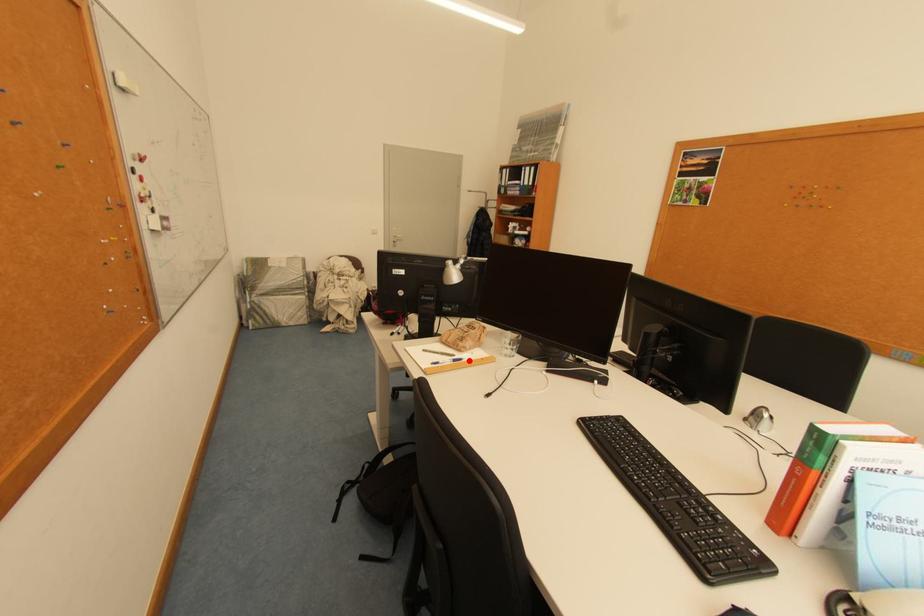
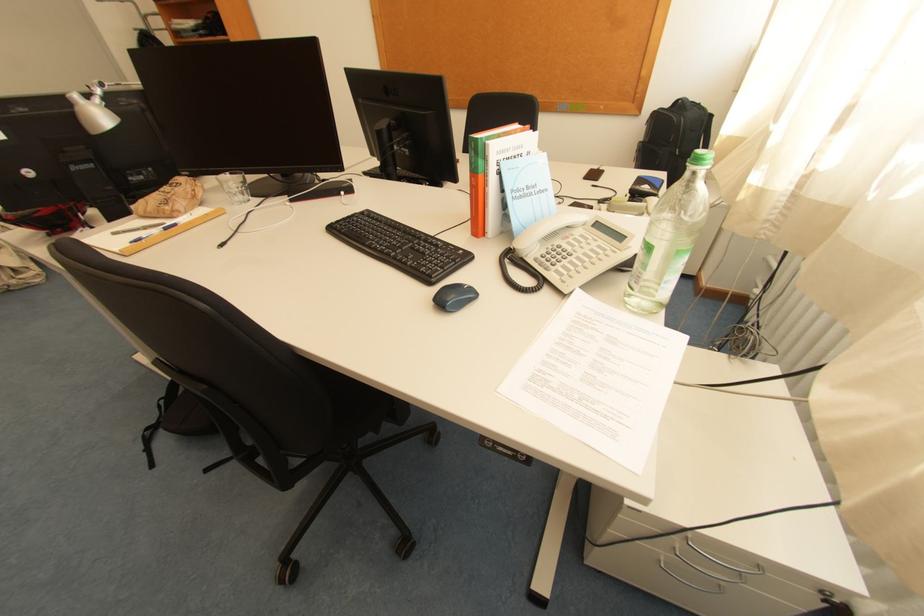
Locate, in the second image, the point that corresponds to the highlighted location in the first image.

(184, 225)